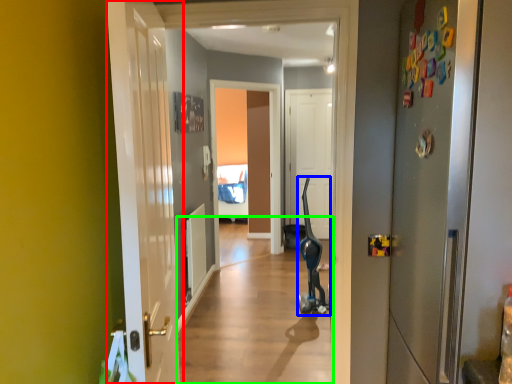
Question: Which object is the farthest from door (highlighted by a red box)? Choose among these: segway (highlighted by a blue box) or alley (highlighted by a green box).

Choices:
 (A) segway
 (B) alley

Answer: (A)